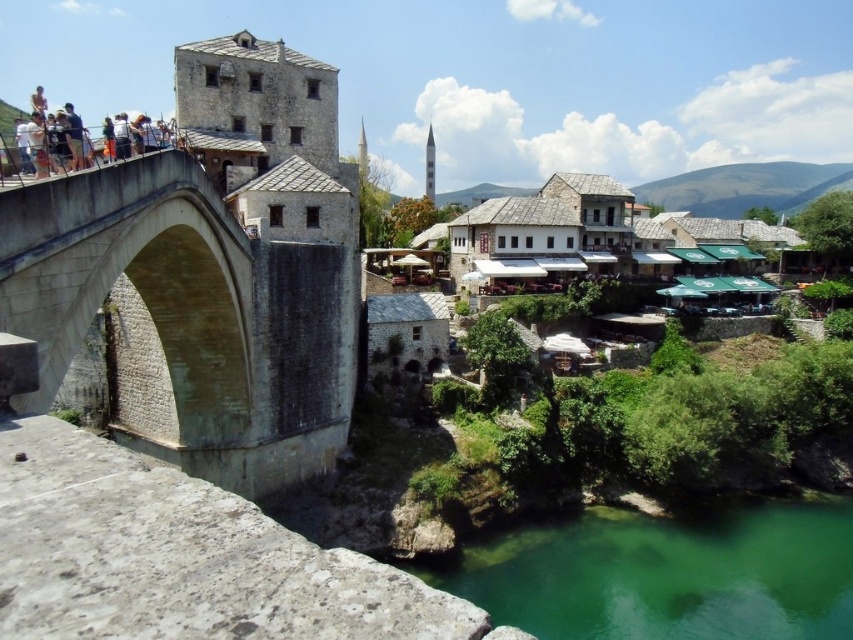
You are a tourist standing on the stone arch bridge at left and want to take a photo of the white stone minaret at upper center. Given that your camera has a maximum zoom range of 100 meters, will you be able to capture the minaret in your photo without moving closer?

The distance between the stone arch bridge at left and the white stone minaret at upper center is 164.85 meters. Since your camera can only zoom up to 100 meters, you won not be able to capture the minaret without moving closer.

You are standing at the point marked as point (173, 317) and want to reach the other side of the bridge. The bridge is 57.48 meters long. If you walk at a speed of 1.5 meters per second, how many seconds will it take you to cross the bridge?

The distance between the two points is 57.48 meters. At a walking speed of 1.5 meters per second, it will take 57.48 divided by 1.5, which equals approximately 38.32 seconds to cross the bridge.

You are a tourist standing at the center of the historic stone bridge. You want to take a photo of the stone arch bridge at left while ensuring the entire bridge is visible in the frame. Based on your current position, will you be able to capture the entire bridge in your camera view?

The stone arch bridge at left is positioned at point (189, 317), which means it is located near the center of the image. Since you are standing at the center of the bridge, you should be able to capture the entire bridge in your camera view by adjusting your angle slightly to include both ends of the bridge in the frame.